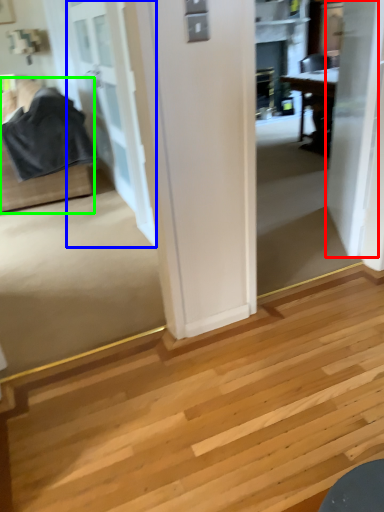
Question: Which object is positioned farthest from door (highlighted by a red box)? Select from door (highlighted by a blue box) and furniture (highlighted by a green box).

Choices:
 (A) door
 (B) furniture

Answer: (B)